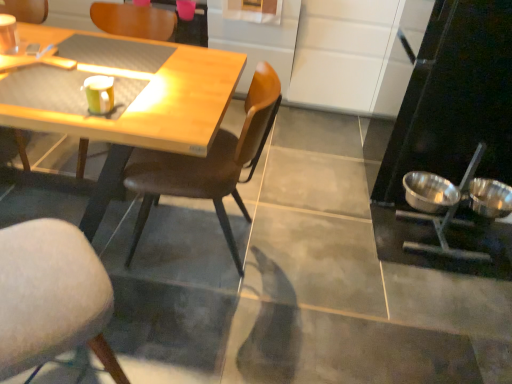
You are a GUI agent. You are given a task and a screenshot of the screen. Output one action in this format:
    pyautogui.click(x=<x>, y=<y>)
    Task: Click on the free space to the left of matte yellow cup at upper left, the 1th coffee cup when ordered from front to back
    
    Given the screenshot: What is the action you would take?
    pyautogui.click(x=60, y=96)